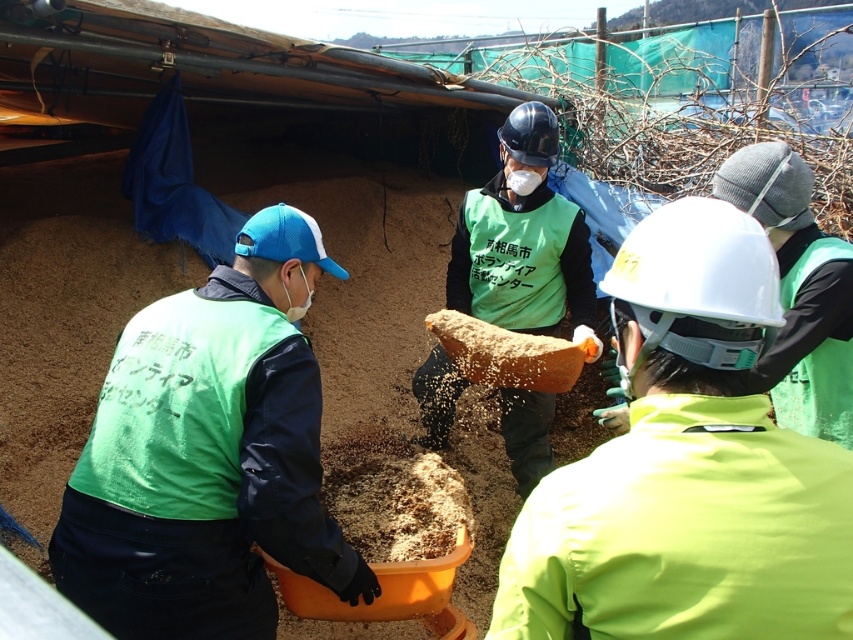
You are a safety inspector observing the workers in the scene. You need to check the vest of the worker wearing the matte green vest at center and the green fabric vest at left. Which worker is positioned to your right side?

The matte green vest at center is positioned to the right of the green fabric vest at left, so the worker wearing the matte green vest at center is to your right side.

You are a safety inspector observing the workers in the scene. You need to determine if the green fabric vest at left has a larger width than the green fabric vest at center. Can you confirm this based on the provided information?

The green fabric vest at left might be wider than green fabric vest at center according to the description.

Please look at the image and locate the point at coordinates (x=688, y=467). What object is exactly at that point?

The matte green vest at center is exactly at point (x=688, y=467).